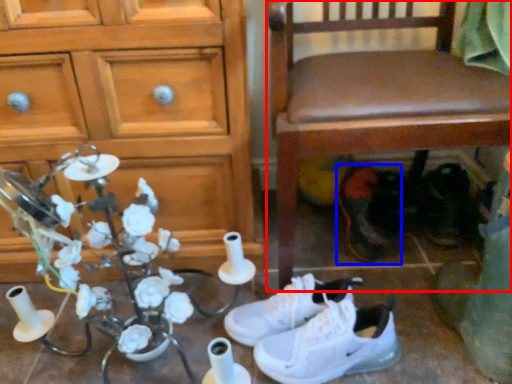
Question: Which object is further to the camera taking this photo, chair (highlighted by a red box) or footwear (highlighted by a blue box)?

Choices:
 (A) chair
 (B) footwear

Answer: (B)